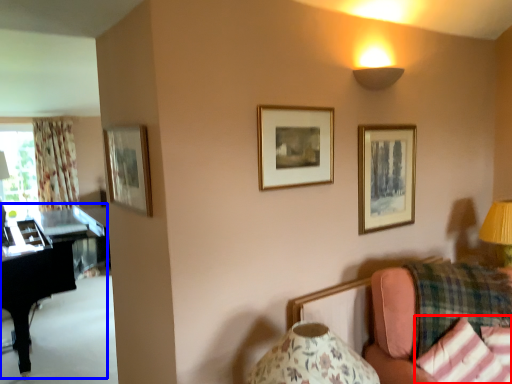
Question: Which object appears closest to the camera in this image, pillow (highlighted by a red box) or piano (highlighted by a blue box)?

Choices:
 (A) pillow
 (B) piano

Answer: (A)